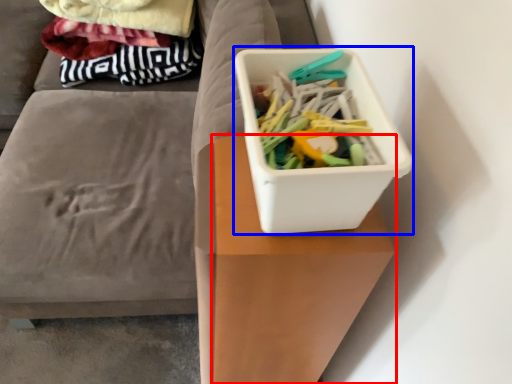
Question: Which object appears farthest to the camera in this image, table (highlighted by a red box) or storage box (highlighted by a blue box)?

Choices:
 (A) table
 (B) storage box

Answer: (A)